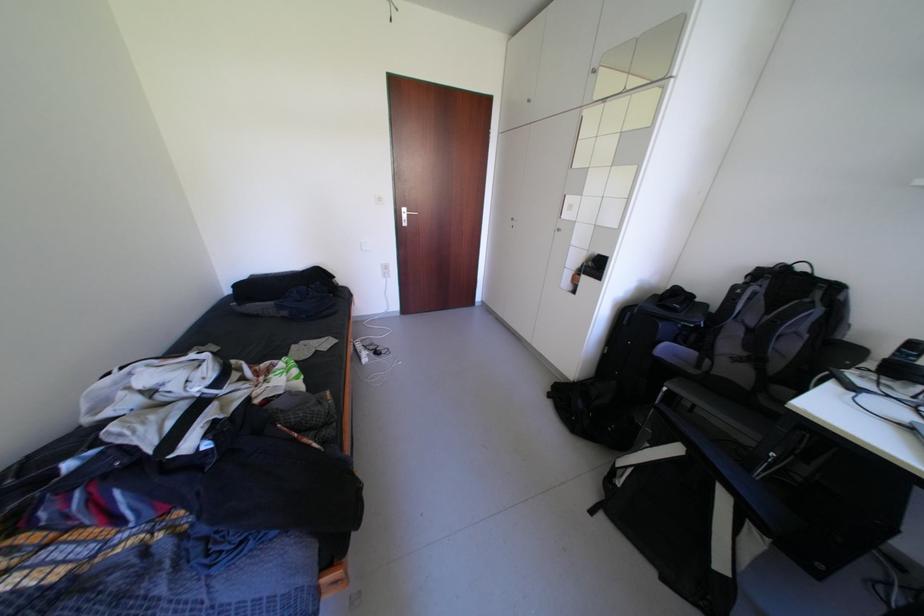
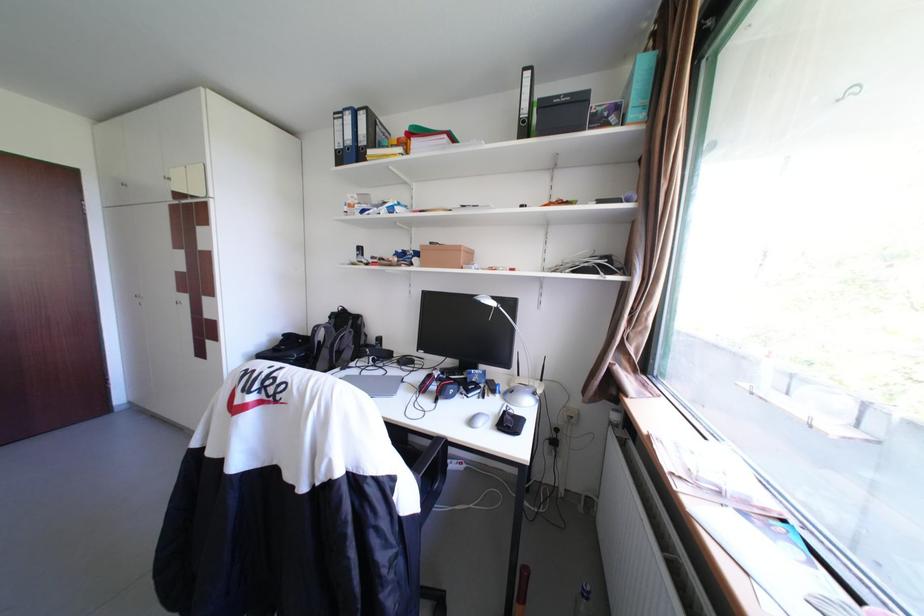
Find the pixel in the second image that matches point 774,283 in the first image.

(344, 321)